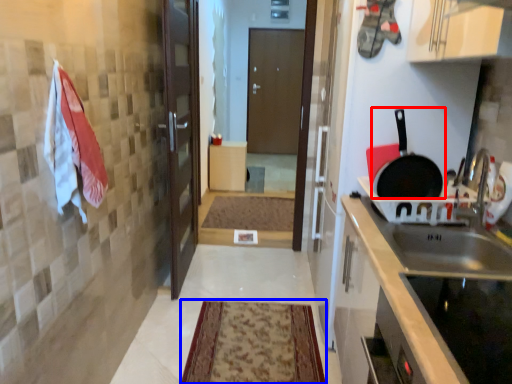
Question: Which of the following is the farthest to the observer, frying pan (highlighted by a red box) or mat (highlighted by a blue box)?

Choices:
 (A) frying pan
 (B) mat

Answer: (B)